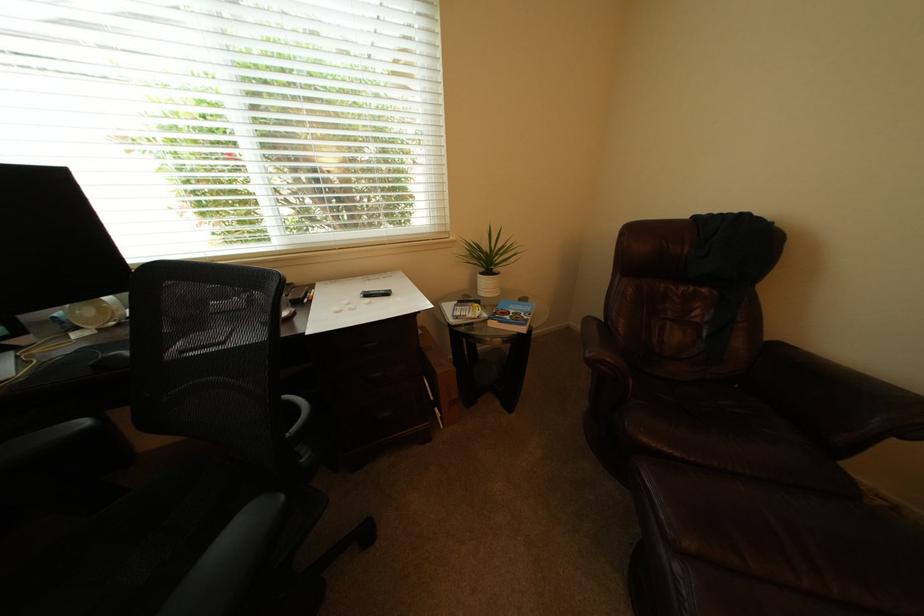
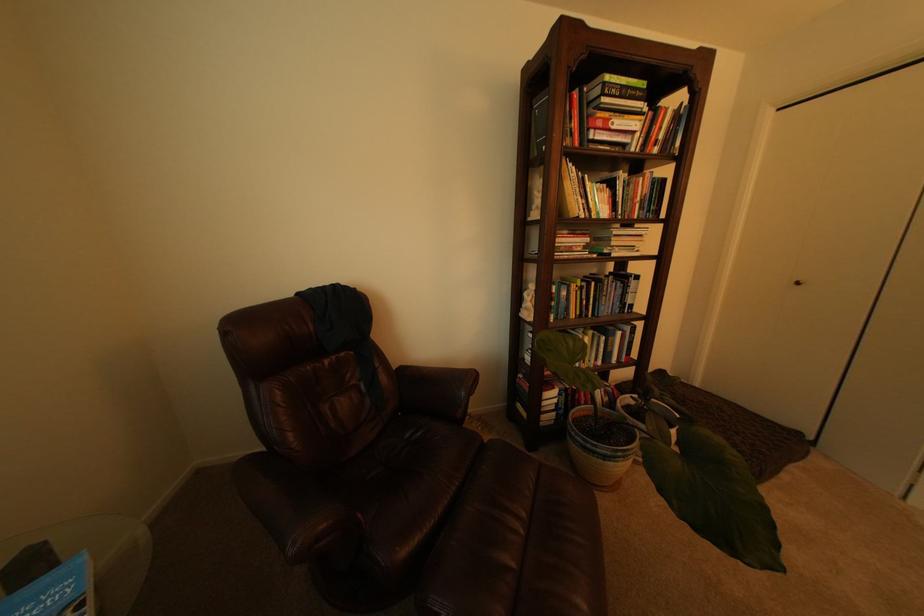
Question: The camera is either moving clockwise (left) or counter-clockwise (right) around the object. The first image is from the beginning of the video and the second image is from the end. Is the camera moving left or right when shooting the video?

Choices:
 (A) Left
 (B) Right

Answer: (A)